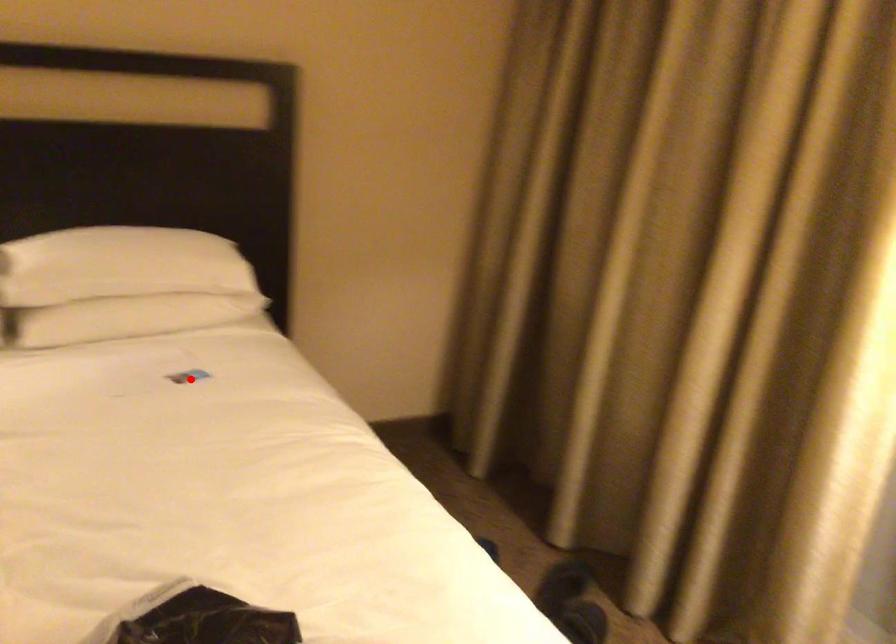
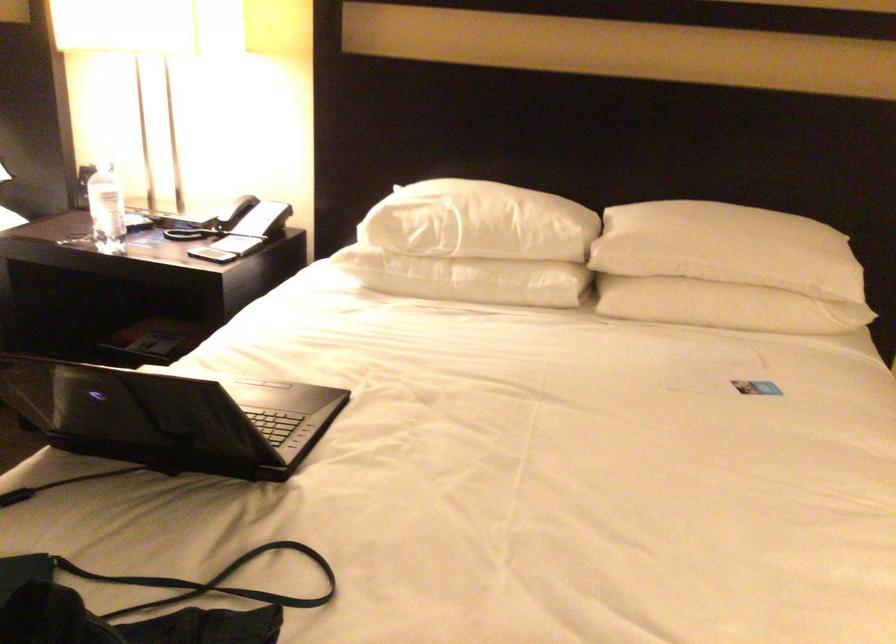
The point at the highlighted location is marked in the first image. Where is the corresponding point in the second image?

(755, 386)